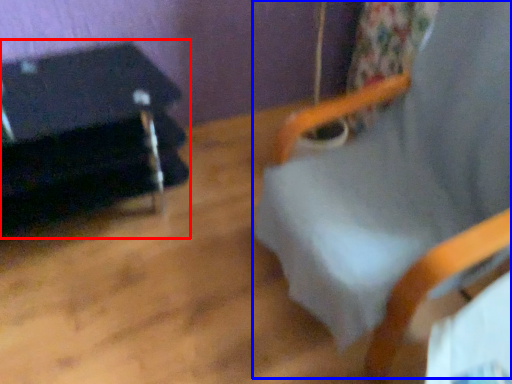
Question: Among these objects, which one is nearest to the camera, furniture (highlighted by a red box) or beach chair (highlighted by a blue box)?

Choices:
 (A) furniture
 (B) beach chair

Answer: (B)